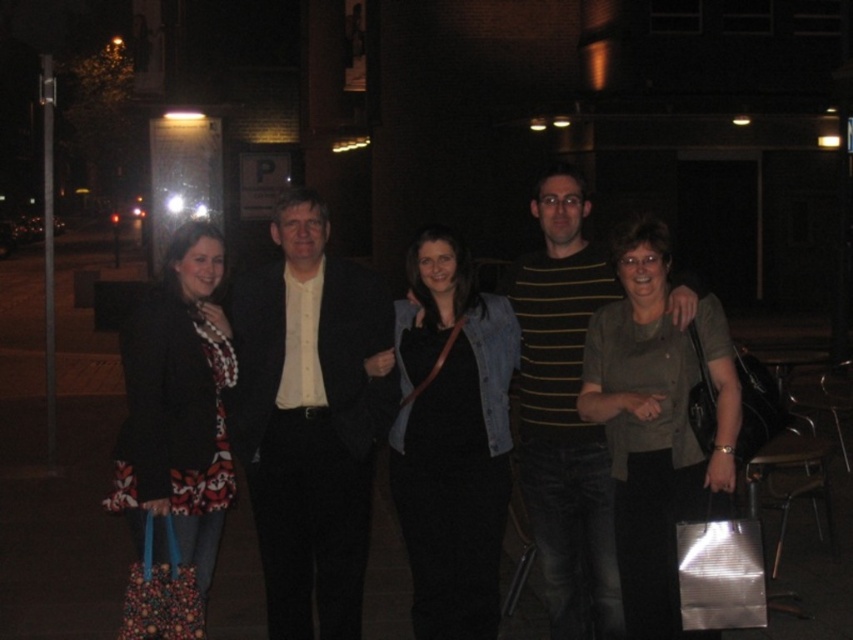
Can you confirm if matte gray shirt at center is positioned above striped cotton shirt at center?

Incorrect, matte gray shirt at center is not positioned above striped cotton shirt at center.

Which is more to the left, matte gray shirt at center or striped cotton shirt at center?

Positioned to the left is striped cotton shirt at center.

What do you see at coordinates (656, 424) in the screenshot?
I see `matte gray shirt at center` at bounding box center [656, 424].

The height and width of the screenshot is (640, 853). In order to click on matte gray shirt at center in this screenshot , I will do `click(656, 424)`.

Can you confirm if denim jacket at center is thinner than matte gray shirt at center?

Incorrect, denim jacket at center's width is not less than matte gray shirt at center's.

Does denim jacket at center have a greater height compared to matte gray shirt at center?

Yes.

Which is behind, point (418, 403) or point (698, 369)?

Positioned behind is point (418, 403).

Identify the location of denim jacket at center. The height and width of the screenshot is (640, 853). (451, 440).

Who is positioned more to the left, matte black suit at center or matte gray shirt at center?

matte black suit at center is more to the left.

Which is in front, point (312, 296) or point (598, 412)?

Point (598, 412) is more forward.

Who is more forward, [375,394] or [614,509]?

Point [614,509]

I want to click on matte black suit at center, so click(310, 419).